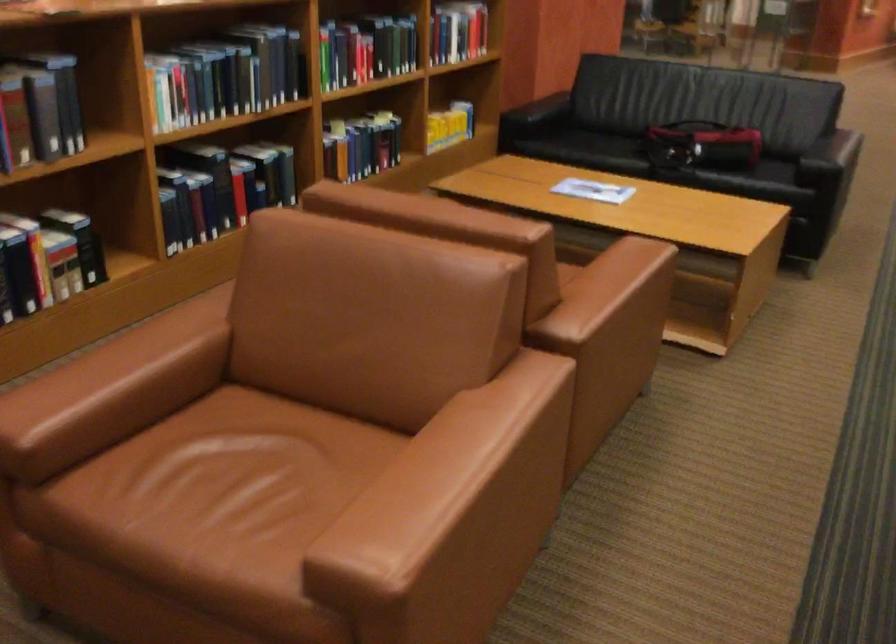
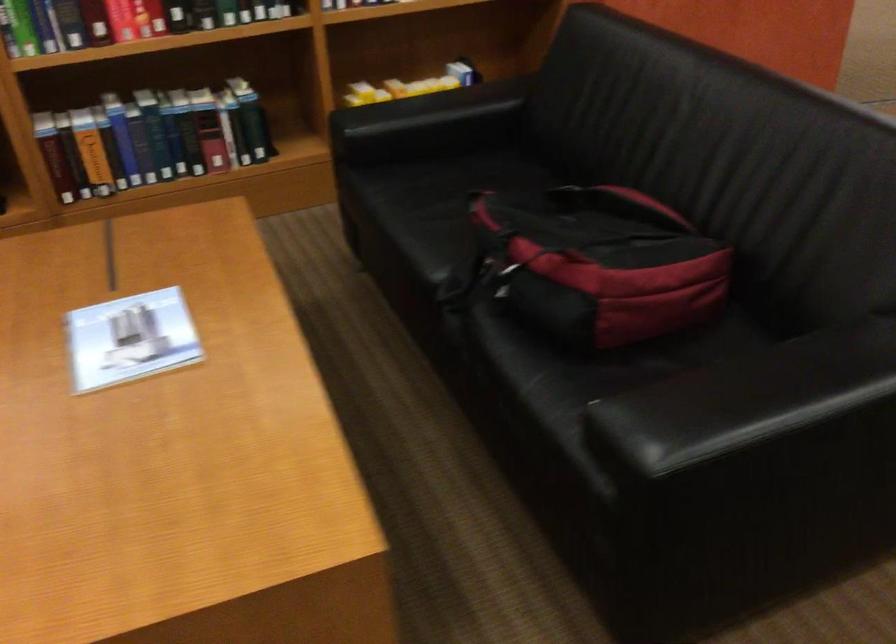
Where in the second image is the point corresponding to (x=590, y=191) from the first image?

(131, 339)